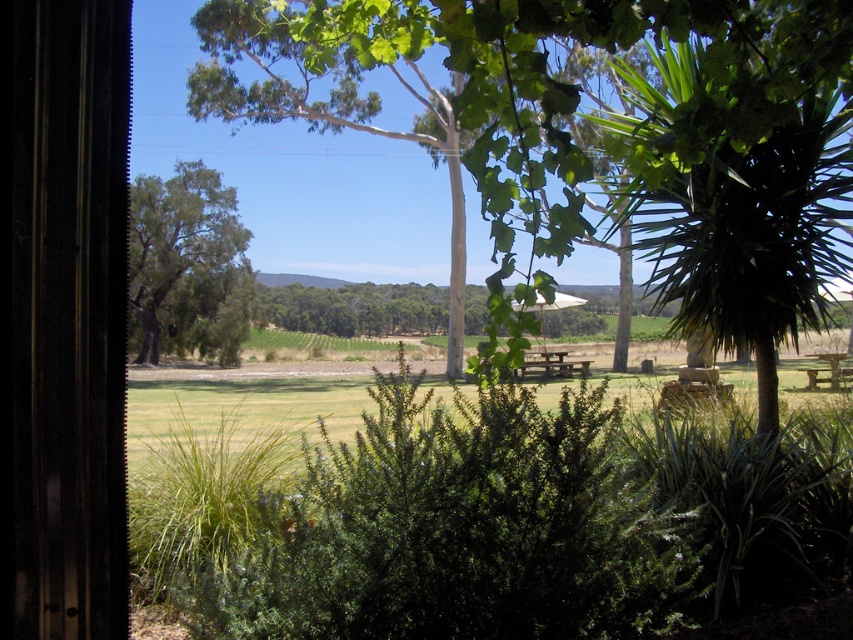
Question: Can you confirm if wooden picnic table at center is positioned to the left of wooden picnic table at lower right?

Choices:
 (A) yes
 (B) no

Answer: (A)

Question: Which point appears closest to the camera in this image?

Choices:
 (A) (535, 120)
 (B) (164, 285)
 (C) (824, 356)

Answer: (A)

Question: Which point appears closest to the camera in this image?

Choices:
 (A) (577, 371)
 (B) (186, 316)

Answer: (A)

Question: Is green leafy tree at center below wooden picnic table at center?

Choices:
 (A) yes
 (B) no

Answer: (B)

Question: Is wooden picnic table at center positioned before wooden picnic table at lower right?

Choices:
 (A) no
 (B) yes

Answer: (B)

Question: Which point is farther from the camera taking this photo?

Choices:
 (A) (828, 362)
 (B) (846, 93)
 (C) (549, 355)

Answer: (C)